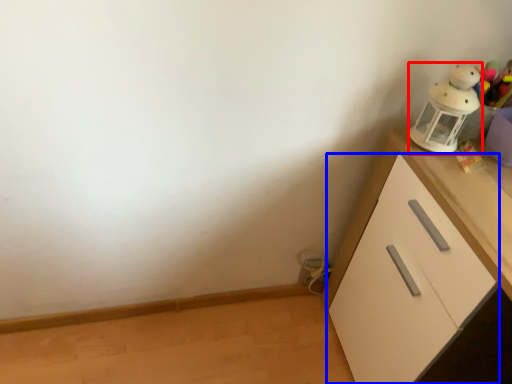
Question: Which point is closer to the camera, toy (highlighted by a red box) or cabinetry (highlighted by a blue box)?

Choices:
 (A) toy
 (B) cabinetry

Answer: (B)